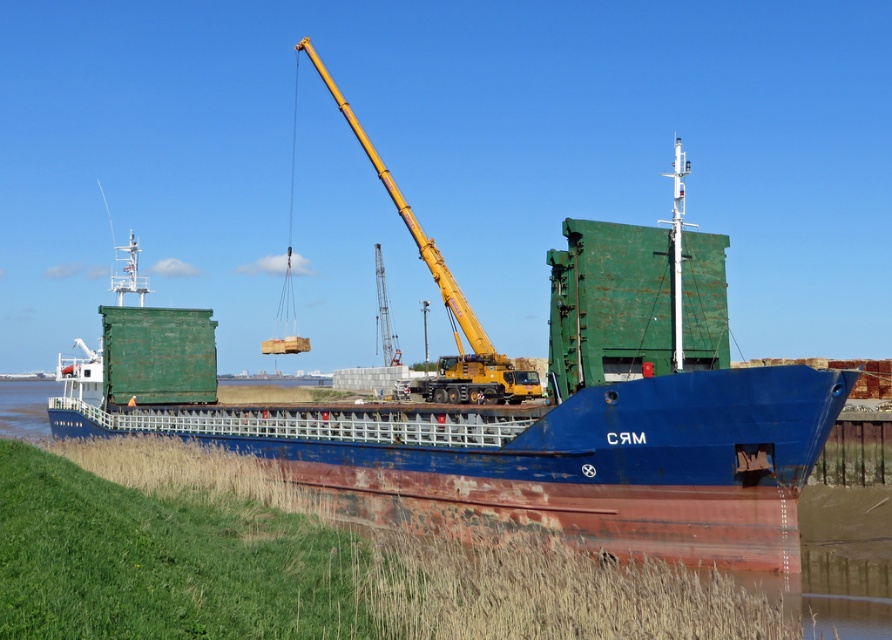
From the picture: Who is shorter, rusty metal barge at center or yellow metallic crane at center?

rusty metal barge at center is shorter.

At what (x,y) coordinates should I click in order to perform the action: click on rusty metal barge at center. Please return your answer as a coordinate pair (x, y). This screenshot has width=892, height=640. Looking at the image, I should click on click(x=534, y=417).

This screenshot has width=892, height=640. What do you see at coordinates (534, 417) in the screenshot?
I see `rusty metal barge at center` at bounding box center [534, 417].

Is point (637, 240) behind point (513, 579)?

Yes.

Which is behind, point (180, 412) or point (301, 573)?

The point (180, 412) is more distant.

Locate an element on the screen. This screenshot has width=892, height=640. rusty metal barge at center is located at coordinates (534, 417).

Is the position of green grass at lower left less distant than that of yellow metallic crane at center?

Yes, green grass at lower left is in front of yellow metallic crane at center.

Between point (423, 579) and point (321, 65), which one is positioned in front?

Positioned in front is point (423, 579).

Where is `green grass at lower left`? The height and width of the screenshot is (640, 892). green grass at lower left is located at coordinates (318, 564).

Locate an element on the screen. Image resolution: width=892 pixels, height=640 pixels. green grass at lower left is located at coordinates (318, 564).